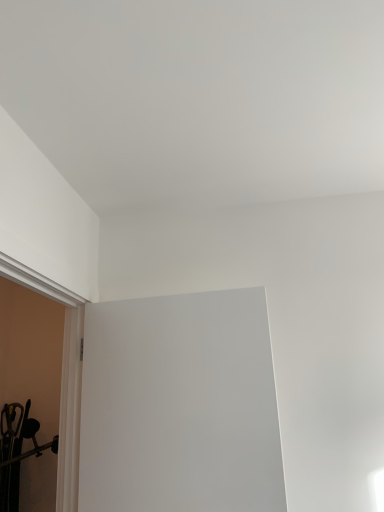
Describe the element at coordinates (180, 405) in the screenshot. This screenshot has height=512, width=384. I see `white matte door at center` at that location.

Image resolution: width=384 pixels, height=512 pixels. I want to click on white matte door at center, so click(180, 405).

The height and width of the screenshot is (512, 384). Describe the element at coordinates (61, 375) in the screenshot. I see `white smooth door frame at left` at that location.

Locate an element on the screen. white smooth door frame at left is located at coordinates (61, 375).

What are the coordinates of `white matte door at center` in the screenshot? It's located at (180, 405).

Is white matte door at center at the left side of white smooth door frame at left?

In fact, white matte door at center is to the right of white smooth door frame at left.

Between white matte door at center and white smooth door frame at left, which one is positioned behind?

white matte door at center is further from the camera.

Between point (117, 395) and point (73, 502), which one is positioned in front?

Point (73, 502)

From the picture: From the image's perspective, is white matte door at center over white smooth door frame at left?

Incorrect, from the image's perspective, white matte door at center is lower than white smooth door frame at left.

From a real-world perspective, is white matte door at center above or below white smooth door frame at left?

Clearly, from a real-world perspective, white matte door at center is below white smooth door frame at left.

In terms of width, does white matte door at center look wider or thinner when compared to white smooth door frame at left?

In the image, white matte door at center appears to be more narrow than white smooth door frame at left.

Is white matte door at center taller than white smooth door frame at left?

In fact, white matte door at center may be shorter than white smooth door frame at left.

Between white matte door at center and white smooth door frame at left, which one has larger size?

white smooth door frame at left.

Is white smooth door frame at left a part of white matte door at center?

Definitely not — white smooth door frame at left is not inside white matte door at center.

Would you consider white matte door at center to be distant from white smooth door frame at left?

That's not correct — white matte door at center is a little close to white smooth door frame at left.

Could you tell me if white matte door at center is turned towards white smooth door frame at left?

Yes, white matte door at center is oriented towards white smooth door frame at left.

Image resolution: width=384 pixels, height=512 pixels. I want to click on window screen that appears below the white smooth door frame at left (from the image's perspective), so click(180, 405).

In the image, is white smooth door frame at left on the left side or the right side of white matte door at center?

Based on their positions, white smooth door frame at left is located to the left of white matte door at center.

Does white smooth door frame at left come in front of white matte door at center?

Yes.

Which is closer, (60,285) or (258,397)?

Point (60,285).

From the image's perspective, does white smooth door frame at left appear higher than white matte door at center?

Correct, white smooth door frame at left appears higher than white matte door at center in the image.

From a real-world perspective, is white smooth door frame at left over white matte door at center?

Correct, in the physical world, white smooth door frame at left is higher than white matte door at center.

In terms of width, does white smooth door frame at left look wider or thinner when compared to white matte door at center?

white smooth door frame at left is wider than white matte door at center.

Between white smooth door frame at left and white matte door at center, which one has more height?

With more height is white smooth door frame at left.

Between white smooth door frame at left and white matte door at center, which one has larger size?

Bigger between the two is white smooth door frame at left.

Is white smooth door frame at left completely or partially outside of white matte door at center?

white smooth door frame at left lies outside white matte door at center's area.

Is white smooth door frame at left placed right next to white matte door at center?

white smooth door frame at left and white matte door at center are clearly separated.

Is white smooth door frame at left looking in the opposite direction of white matte door at center?

No, white smooth door frame at left's orientation is not away from white matte door at center.

What's the angular difference between white smooth door frame at left and white matte door at center's facing directions?

95.3 degrees separate the facing orientations of white smooth door frame at left and white matte door at center.

This screenshot has width=384, height=512. Find the location of `window sill lying on the left of white matte door at center`. window sill lying on the left of white matte door at center is located at coordinates (61, 375).

Locate an element on the screen. The width and height of the screenshot is (384, 512). window sill in front of the white matte door at center is located at coordinates (61, 375).

Where is `window screen behind the white smooth door frame at left`? window screen behind the white smooth door frame at left is located at coordinates (180, 405).